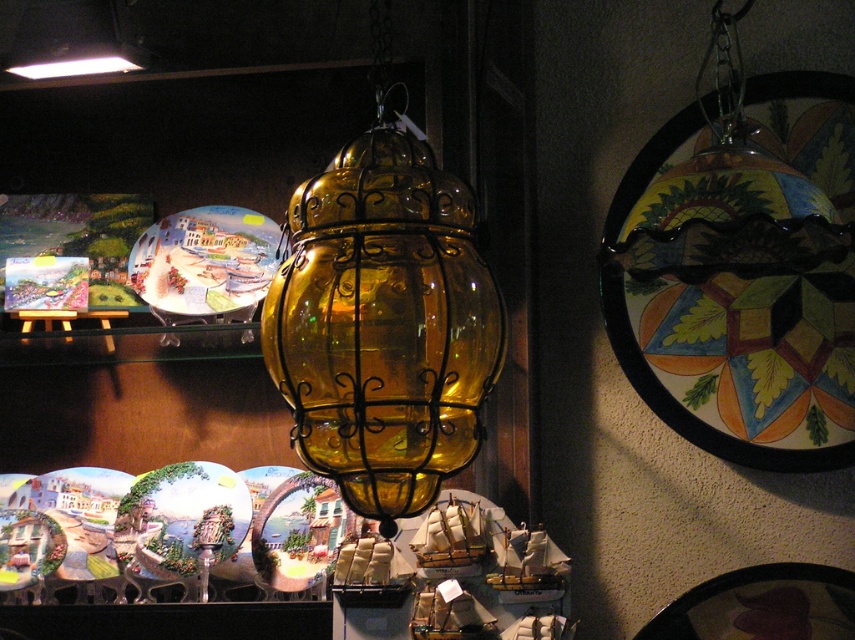
Which is more to the left, amber glass lantern at center or matte ceramic plate at upper center?

From the viewer's perspective, matte ceramic plate at upper center appears more on the left side.

Is point (369, 314) closer to viewer compared to point (210, 316)?

Yes, it is.

This screenshot has height=640, width=855. What are the coordinates of `amber glass lantern at center` in the screenshot? It's located at pos(382,323).